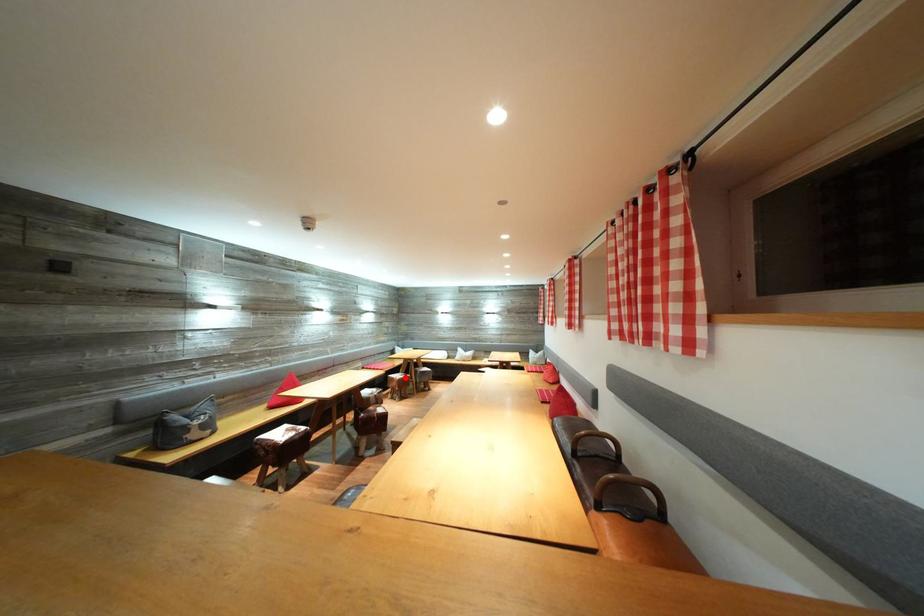
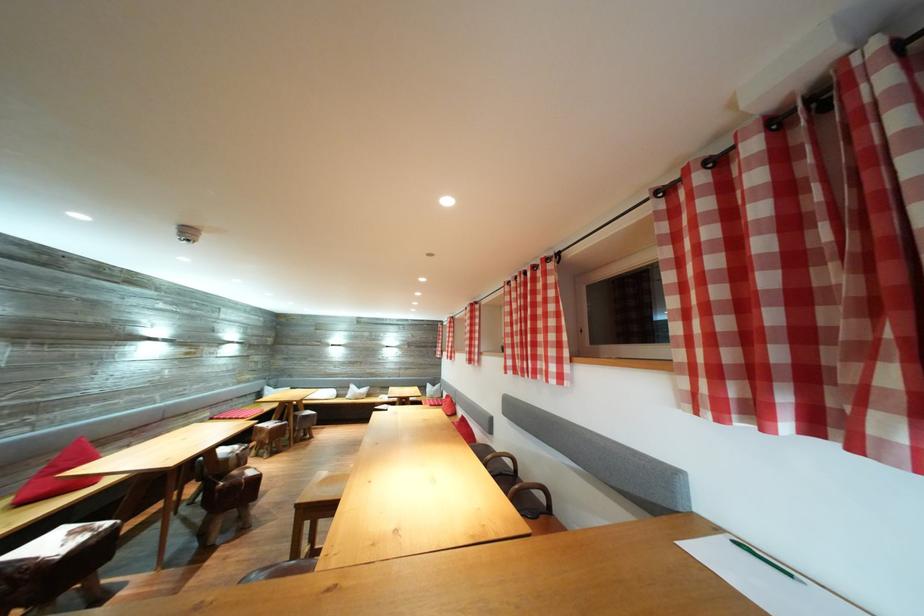
The point at the highlighted location is marked in the first image. Where is the corresponding point in the second image?

(275, 424)